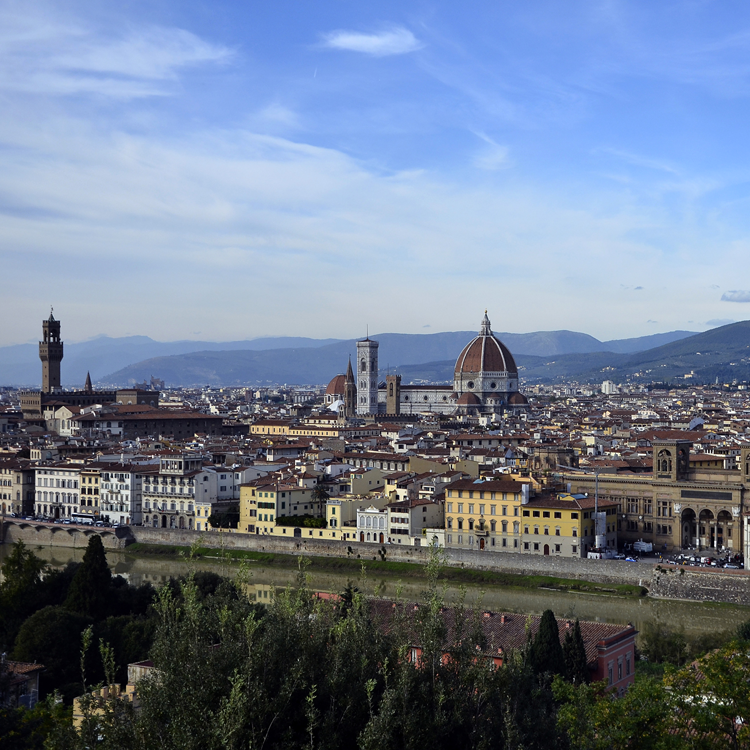
The width and height of the screenshot is (750, 750). Find the location of `concrete wall`. concrete wall is located at coordinates (502, 559), (262, 544).